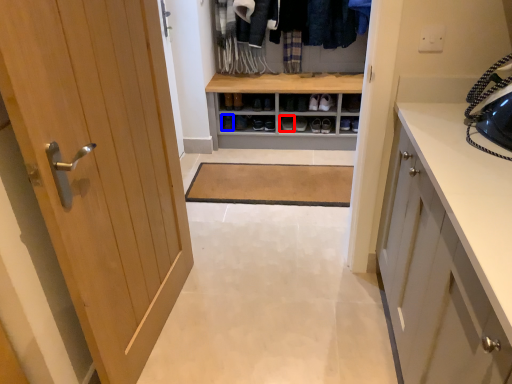
Question: Which object appears closest to the camera in this image, footwear (highlighted by a red box) or shoe (highlighted by a blue box)?

Choices:
 (A) footwear
 (B) shoe

Answer: (A)